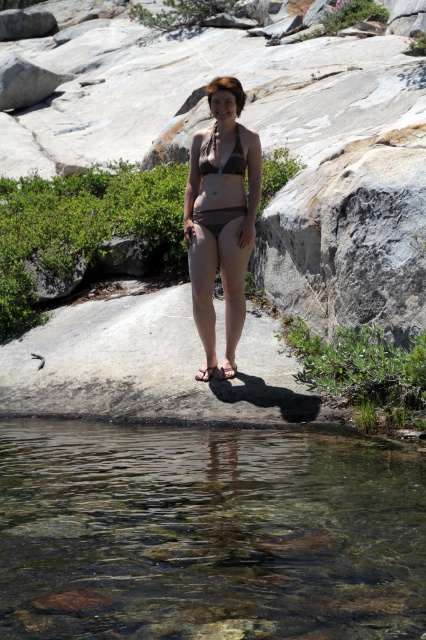
Between brown matte bikini at center and matte brown bikini top at center, which one has less height?

matte brown bikini top at center

The image size is (426, 640). Find the location of `brown matte bikini at center`. brown matte bikini at center is located at coordinates (221, 218).

The image size is (426, 640). I want to click on matte black bikini at center, so click(x=226, y=161).

Is point (17, 173) in front of point (226, 244)?

No, it is not.

Which is behind, point (362, 92) or point (222, 268)?

The point (362, 92) is more distant.

The height and width of the screenshot is (640, 426). In order to click on gray rock at center in this screenshot , I will do `click(264, 148)`.